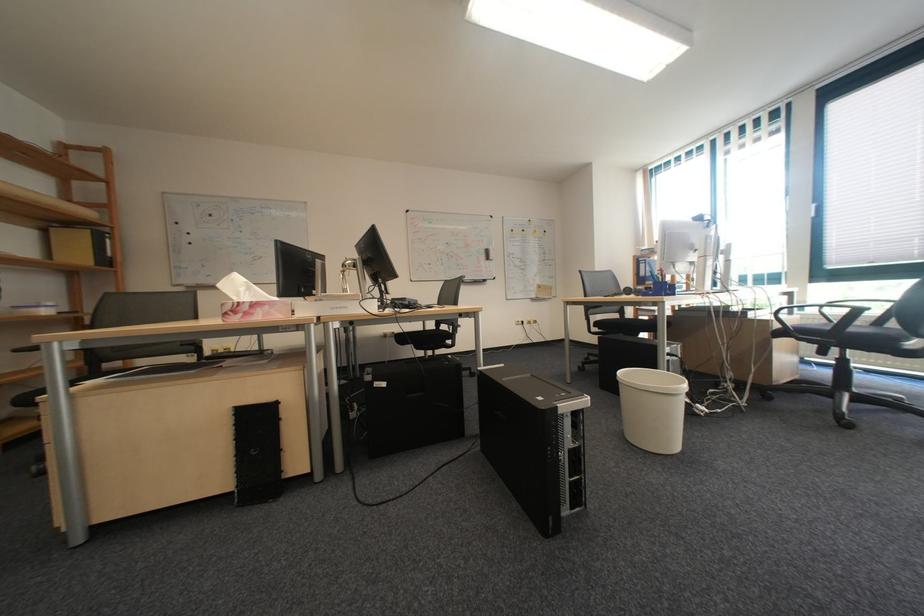
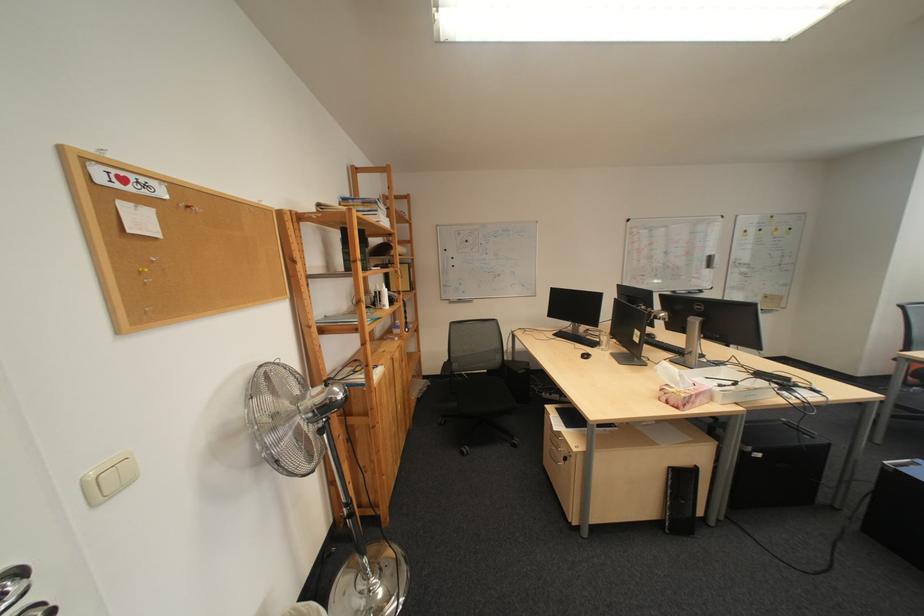
Where in the second image is the point corresponding to the point at 252,296 from the first image?

(690, 385)